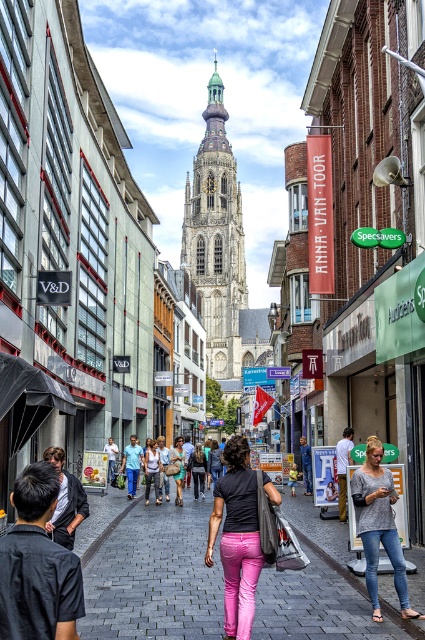
Question: Which point is closer to the camera?

Choices:
 (A) (380, 484)
 (B) (252, 588)

Answer: (B)

Question: Considering the relative positions of matte black shirt at center and matte black dress at center in the image provided, where is matte black shirt at center located with respect to matte black dress at center?

Choices:
 (A) above
 (B) below

Answer: (A)

Question: Can you confirm if paved stone sidewalk at center is wider than gray cotton shirt at center?

Choices:
 (A) no
 (B) yes

Answer: (B)

Question: Can you confirm if matte black shirt at center is positioned below pink fabric pants at center?

Choices:
 (A) yes
 (B) no

Answer: (B)

Question: Which point is closer to the camera taking this photo?

Choices:
 (A) (320, 557)
 (B) (374, 532)

Answer: (B)

Question: Which object is farther from the camera taking this photo?

Choices:
 (A) gray cotton shirt at center
 (B) paved stone sidewalk at center
 (C) matte black dress at center
 (D) pink fabric pants at center

Answer: (D)